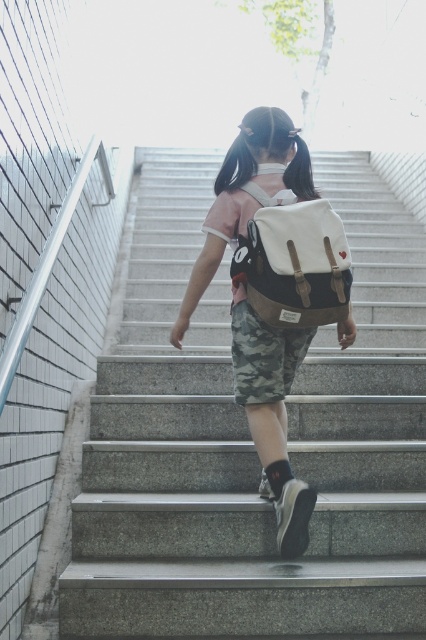
Locate an element on the screen. This screenshot has height=640, width=426. canvas/leather backpack at center is located at coordinates (293, 260).

Between point (253, 246) and point (247, 404), which one is positioned in front?

Point (253, 246)

Who is more distant from viewer, (270, 298) or (264, 353)?

Positioned behind is point (264, 353).

The height and width of the screenshot is (640, 426). What are the coordinates of `canvas/leather backpack at center` in the screenshot? It's located at (293, 260).

The height and width of the screenshot is (640, 426). I want to click on gray concrete stairs at center, so click(253, 445).

Based on the photo, does gray concrete stairs at center appear on the right side of canvas/leather backpack at center?

Yes, gray concrete stairs at center is to the right of canvas/leather backpack at center.

Who is more distant from viewer, (154, 568) or (255, 296)?

Point (255, 296)

Where is `gray concrete stairs at center`? The height and width of the screenshot is (640, 426). gray concrete stairs at center is located at coordinates (253, 445).

Which is below, camouflage shorts at center or camo fabric shorts at center?

camo fabric shorts at center

Between point (322, 312) and point (284, 358), which one is positioned in front?

Positioned in front is point (322, 312).

Who is more distant from viewer, (258, 410) or (282, 396)?

Point (282, 396)

You are a GUI agent. You are given a task and a screenshot of the screen. Output one action in this format:
    pyautogui.click(x=<x>, y=<y>)
    Task: Click on the camouflage shorts at center
    This screenshot has height=640, width=426.
    Given the screenshot: What is the action you would take?
    pyautogui.click(x=273, y=291)